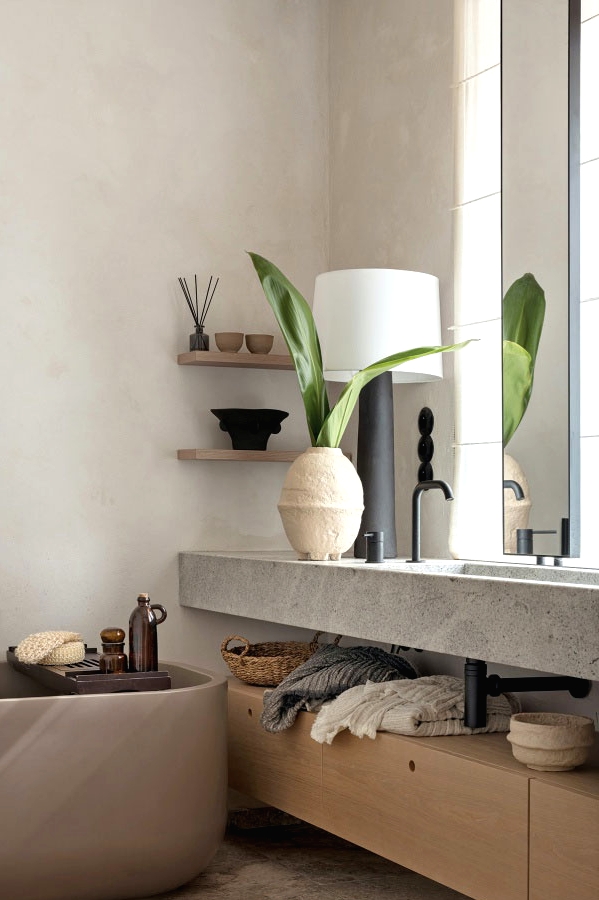
This screenshot has width=599, height=900. I want to click on lamp shade, so click(x=374, y=321).